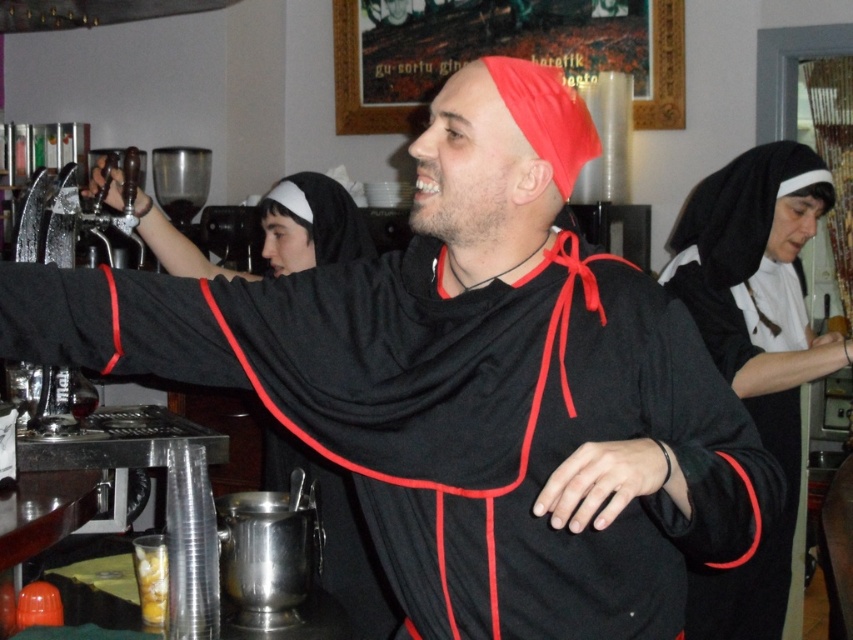
Is black velvet habit at upper right bigger than translucent plastic cup at lower left?

Yes.

Does point (737, 576) come closer to viewer compared to point (164, 566)?

That is False.

Where is `black velvet habit at upper right`? black velvet habit at upper right is located at coordinates (756, 353).